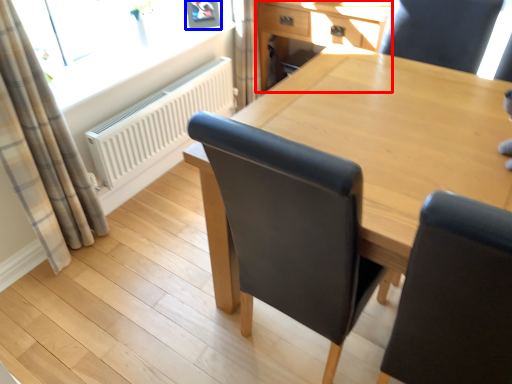
Question: Which object appears farthest to the camera in this image, computer desk (highlighted by a red box) or picture frame (highlighted by a blue box)?

Choices:
 (A) computer desk
 (B) picture frame

Answer: (B)